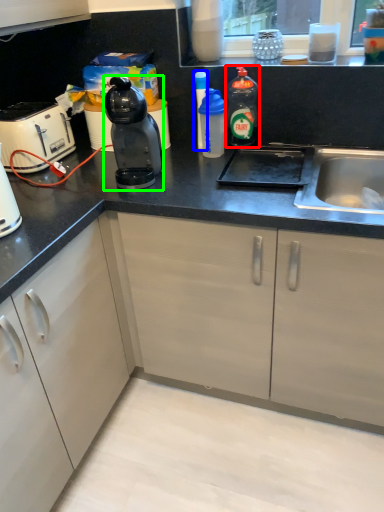
Question: Considering the real-world distances, which object is farthest from bottle (highlighted by a red box)? bottle (highlighted by a blue box) or kitchen appliance (highlighted by a green box)?

Choices:
 (A) bottle
 (B) kitchen appliance

Answer: (B)